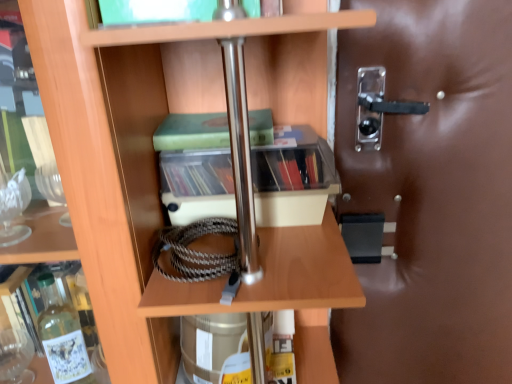
Identify the location of free space above green matte book at center (from a real-world perspective). This screenshot has height=384, width=512. (209, 116).